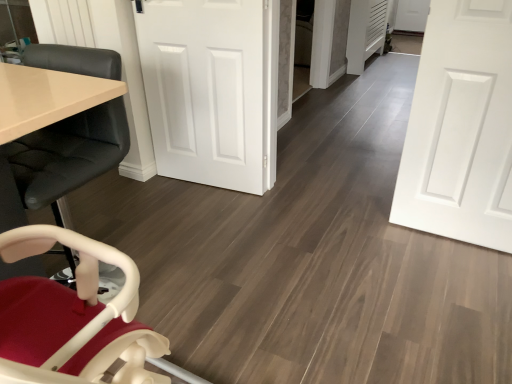
Question: From the image's perspective, is matte black chair at left on white smooth door at center, marked as the 2th door in a right-to-left arrangement?

Choices:
 (A) yes
 (B) no

Answer: (B)

Question: Is matte black chair at left taller than white smooth door at center, marked as the 2th door in a right-to-left arrangement?

Choices:
 (A) no
 (B) yes

Answer: (A)

Question: Is matte black chair at left positioned before white smooth door at center, acting as the first door starting from the left?

Choices:
 (A) no
 (B) yes

Answer: (B)

Question: Is matte black chair at left to the left of white smooth door at center, acting as the first door starting from the left, from the viewer's perspective?

Choices:
 (A) no
 (B) yes

Answer: (B)

Question: Is matte black chair at left oriented towards white smooth door at center, acting as the first door starting from the left?

Choices:
 (A) no
 (B) yes

Answer: (A)

Question: In the image, is matte black chair at left positioned in front of or behind white matte door at center, placed as the second door when sorted from left to right?

Choices:
 (A) front
 (B) behind

Answer: (A)

Question: From a real-world perspective, is matte black chair at left physically located above or below white matte door at center, placed as the second door when sorted from left to right?

Choices:
 (A) above
 (B) below

Answer: (B)

Question: Is point (18, 173) closer or farther from the camera than point (486, 168)?

Choices:
 (A) closer
 (B) farther

Answer: (A)

Question: From the image's perspective, is matte black chair at left positioned above or below white matte door at center, placed as the second door when sorted from left to right?

Choices:
 (A) below
 (B) above

Answer: (A)

Question: Based on their sizes in the image, would you say matte black chair at left is bigger or smaller than white smooth door at center, acting as the first door starting from the left?

Choices:
 (A) big
 (B) small

Answer: (A)

Question: In terms of width, does matte black chair at left look wider or thinner when compared to white smooth door at center, marked as the 2th door in a right-to-left arrangement?

Choices:
 (A) wide
 (B) thin

Answer: (A)

Question: Considering the positions of point tap(105, 145) and point tap(266, 31), is point tap(105, 145) closer or farther from the camera than point tap(266, 31)?

Choices:
 (A) closer
 (B) farther

Answer: (A)

Question: From a real-world perspective, is matte black chair at left above or below white smooth door at center, marked as the 2th door in a right-to-left arrangement?

Choices:
 (A) above
 (B) below

Answer: (B)

Question: From the image's perspective, relative to matte black chair at left, is white smooth door at center, marked as the 2th door in a right-to-left arrangement, above or below?

Choices:
 (A) below
 (B) above

Answer: (B)

Question: From their relative heights in the image, would you say white smooth door at center, acting as the first door starting from the left, is taller or shorter than matte black chair at left?

Choices:
 (A) tall
 (B) short

Answer: (A)